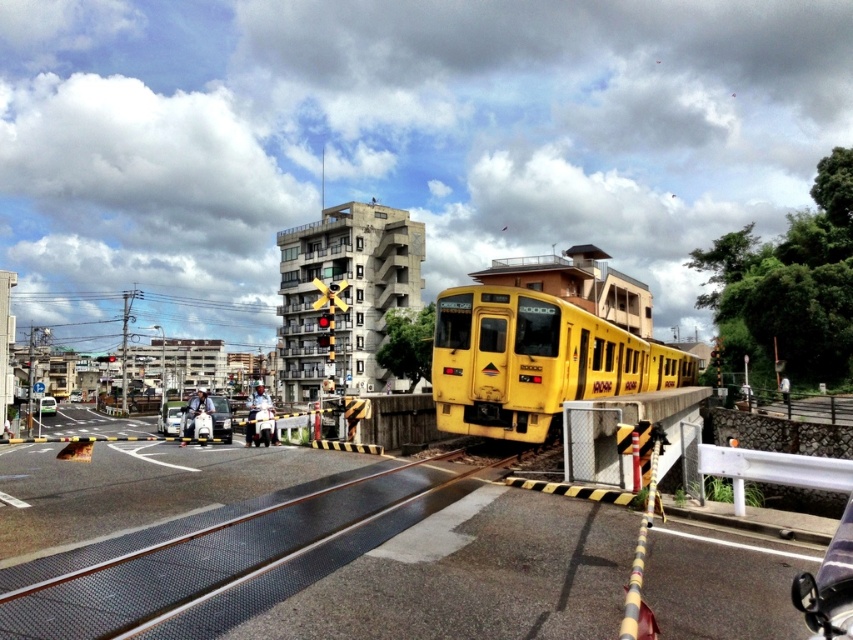
Who is positioned more to the right, metallic silver car at lower left or green matte car at lower left?

metallic silver car at lower left

Can you confirm if metallic silver car at lower left is smaller than green matte car at lower left?

Correct, metallic silver car at lower left occupies less space than green matte car at lower left.

Does point (175, 404) lie in front of point (44, 397)?

Yes.

The width and height of the screenshot is (853, 640). Identify the location of metallic silver car at lower left. (170, 417).

Based on the photo, does white matte car at center have a greater height compared to green matte car at lower left?

Incorrect, white matte car at center's height is not larger of green matte car at lower left's.

In the scene shown: Does white matte car at center have a greater width compared to green matte car at lower left?

No.

Which is behind, point (218, 397) or point (44, 404)?

The point (44, 404) is more distant.

Where is `white matte car at center`? This screenshot has height=640, width=853. white matte car at center is located at coordinates (206, 419).

Between black rubber train track at lower center and yellow matte train at center, which one has more height?

yellow matte train at center is taller.

Can you confirm if black rubber train track at lower center is bigger than yellow matte train at center?

No.

You are a GUI agent. You are given a task and a screenshot of the screen. Output one action in this format:
    pyautogui.click(x=<x>, y=<y>)
    Task: Click on the black rubber train track at lower center
    The height and width of the screenshot is (640, 853).
    Given the screenshot: What is the action you would take?
    pyautogui.click(x=221, y=557)